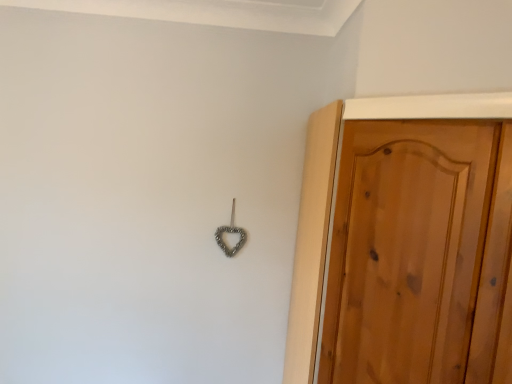
Question: Is metallic heart-shaped hook at center bigger or smaller than wooden door at right?

Choices:
 (A) small
 (B) big

Answer: (A)

Question: Is metallic heart-shaped hook at center inside or outside of wooden door at right?

Choices:
 (A) outside
 (B) inside

Answer: (A)

Question: Looking at their shapes, would you say metallic heart-shaped hook at center is wider or thinner than wooden door at right?

Choices:
 (A) thin
 (B) wide

Answer: (A)

Question: From a real-world perspective, is wooden door at right above or below metallic heart-shaped hook at center?

Choices:
 (A) above
 (B) below

Answer: (B)

Question: In the image, is wooden door at right on the left side or the right side of metallic heart-shaped hook at center?

Choices:
 (A) left
 (B) right

Answer: (B)

Question: Considering their positions, is wooden door at right located in front of or behind metallic heart-shaped hook at center?

Choices:
 (A) front
 (B) behind

Answer: (A)

Question: Do you think wooden door at right is within metallic heart-shaped hook at center, or outside of it?

Choices:
 (A) outside
 (B) inside

Answer: (A)